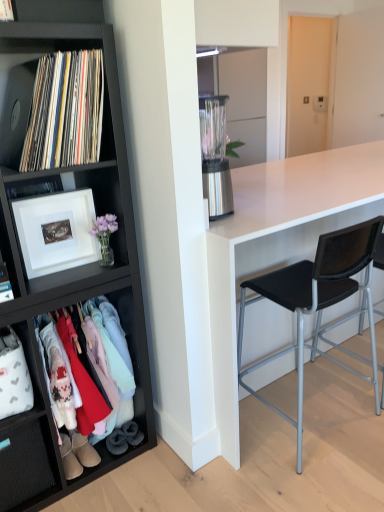
Locate an element on the screen. This screenshot has height=512, width=384. empty space that is to the right of velvet grey boot at lower left, the 1th shoe from the left is located at coordinates (144, 447).